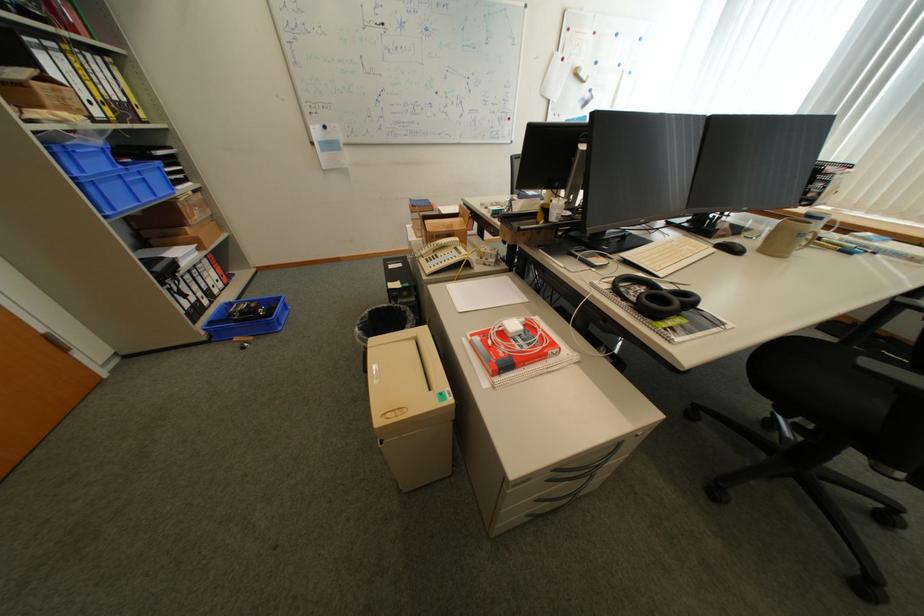
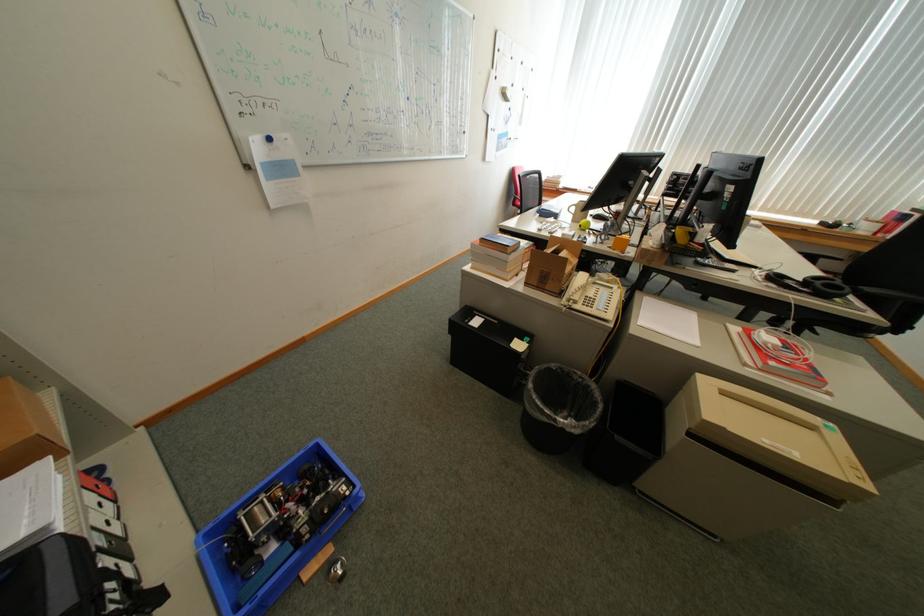
Find the pixel in the second image that matches point 367,331 in the first image.

(572, 421)